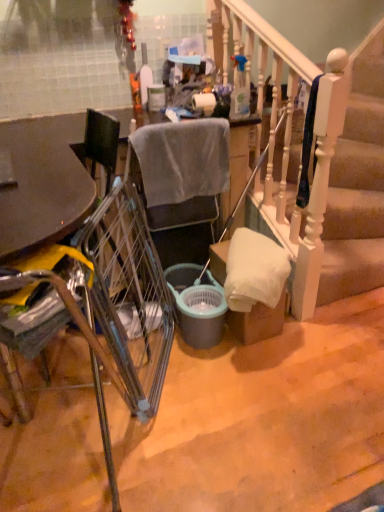
Find the location of a particular element. free spot to the right of metallic silver trolley at center is located at coordinates (230, 387).